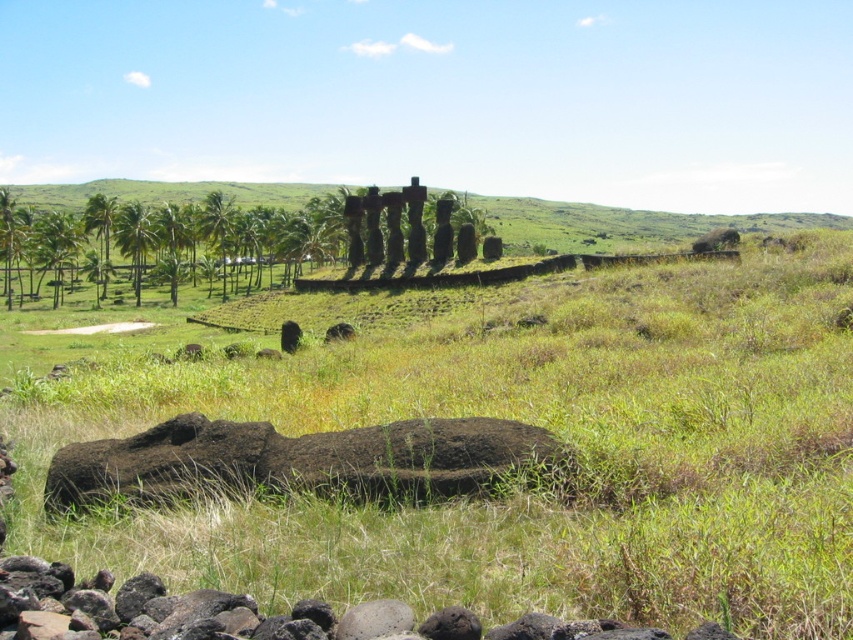
You are standing in the middle of the grassy field and want to take a photo of the green leafy palm tree at left. Which direction should you face to ensure the green grassy at center is not blocking your view?

You should face away from the green leafy palm tree at left so that the green grassy at center is below it and not blocking the view.

Consider the image. You are planning to set up a picnic blanket in the scene. You have two options for placement based on the objects present. Which location would give you more space, placing it on the green grassy at center or the black rough rock at lower center?

The green grassy at center is larger in size than the black rough rock at lower center, so placing the picnic blanket on the green grassy at center would provide more space.

You are standing in the grassy field with the ancient stone statues. There are two points marked in the scene. The first point is at coordinates point [532,442] and the second is at point [207,228]. Which point is closer to you?

Point [532,442] is closer to the camera than point [207,228], so the first point is closer to you.